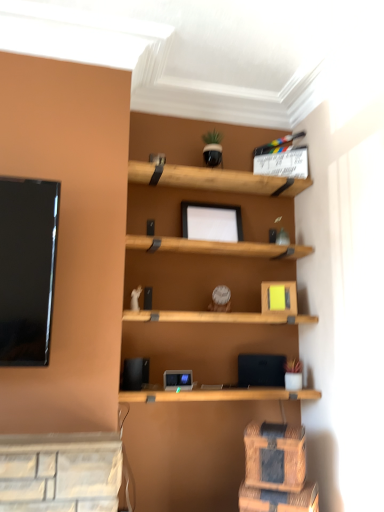
Question: Is blue fabric drawer at lower right, the first drawer ordered from the bottom, bigger than woven wood drawer at lower right, acting as the 2th drawer starting from the bottom?

Choices:
 (A) yes
 (B) no

Answer: (A)

Question: Does blue fabric drawer at lower right, the first drawer ordered from the bottom, have a greater height compared to woven wood drawer at lower right, the 1th drawer positioned from the top?

Choices:
 (A) no
 (B) yes

Answer: (A)

Question: From the image's perspective, is blue fabric drawer at lower right, positioned as the 2th drawer in top-to-bottom order, under woven wood drawer at lower right, acting as the 2th drawer starting from the bottom?

Choices:
 (A) yes
 (B) no

Answer: (A)

Question: Is blue fabric drawer at lower right, positioned as the 2th drawer in top-to-bottom order, to the left of woven wood drawer at lower right, the 1th drawer positioned from the top, from the viewer's perspective?

Choices:
 (A) yes
 (B) no

Answer: (B)

Question: Is blue fabric drawer at lower right, the first drawer ordered from the bottom, smaller than woven wood drawer at lower right, the 1th drawer positioned from the top?

Choices:
 (A) no
 (B) yes

Answer: (A)

Question: From the image's perspective, is blue fabric drawer at lower right, the first drawer ordered from the bottom, above woven wood drawer at lower right, acting as the 2th drawer starting from the bottom?

Choices:
 (A) yes
 (B) no

Answer: (B)

Question: From the image's perspective, is woven wood drawer at lower right, acting as the 2th drawer starting from the bottom, located above blue fabric drawer at lower right, positioned as the 2th drawer in top-to-bottom order?

Choices:
 (A) yes
 (B) no

Answer: (A)

Question: Is woven wood drawer at lower right, acting as the 2th drawer starting from the bottom, in front of blue fabric drawer at lower right, the first drawer ordered from the bottom?

Choices:
 (A) yes
 (B) no

Answer: (B)

Question: Is blue fabric drawer at lower right, positioned as the 2th drawer in top-to-bottom order, at the back of woven wood drawer at lower right, the 1th drawer positioned from the top?

Choices:
 (A) no
 (B) yes

Answer: (A)

Question: Is woven wood drawer at lower right, acting as the 2th drawer starting from the bottom, positioned behind blue fabric drawer at lower right, positioned as the 2th drawer in top-to-bottom order?

Choices:
 (A) no
 (B) yes

Answer: (B)

Question: Is woven wood drawer at lower right, the 1th drawer positioned from the top, wider than blue fabric drawer at lower right, positioned as the 2th drawer in top-to-bottom order?

Choices:
 (A) yes
 (B) no

Answer: (B)

Question: Is woven wood drawer at lower right, acting as the 2th drawer starting from the bottom, aimed at blue fabric drawer at lower right, the first drawer ordered from the bottom?

Choices:
 (A) no
 (B) yes

Answer: (A)

Question: From a real-world perspective, is woven wood drawer at lower right, acting as the 2th drawer starting from the bottom, physically located above or below blue fabric drawer at lower right, positioned as the 2th drawer in top-to-bottom order?

Choices:
 (A) below
 (B) above

Answer: (B)